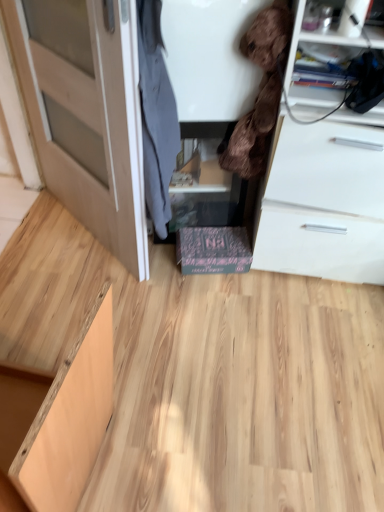
Locate an element on the screen. blank space above natural wood plywood at center (from a real-world perspective) is located at coordinates (220, 339).